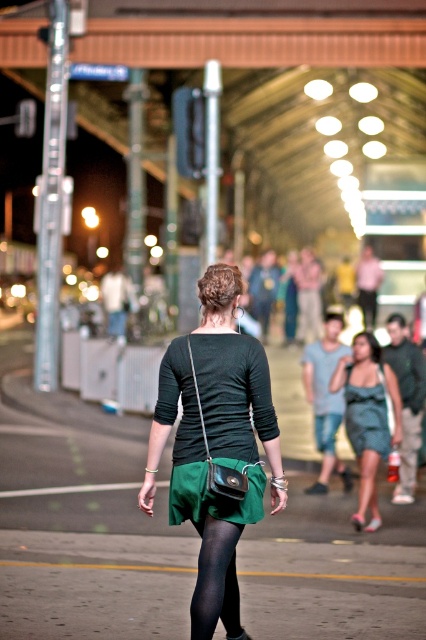
Question: Which object is farther from the camera taking this photo?

Choices:
 (A) teal satin dress at center
 (B) green fabric skirt at center

Answer: (A)

Question: Is matte green dress at center to the right of black tights at center from the viewer's perspective?

Choices:
 (A) yes
 (B) no

Answer: (A)

Question: Is matte green dress at center to the left of black tights at center from the viewer's perspective?

Choices:
 (A) yes
 (B) no

Answer: (B)

Question: Which point is farther to the camera?

Choices:
 (A) (259, 625)
 (B) (370, 390)

Answer: (B)

Question: Which point is closer to the camera?

Choices:
 (A) matte green dress at center
 (B) matte green skirt at center
 (C) green fabric skirt at center

Answer: (B)

Question: Is matte green skirt at center behind matte green dress at center?

Choices:
 (A) yes
 (B) no

Answer: (B)